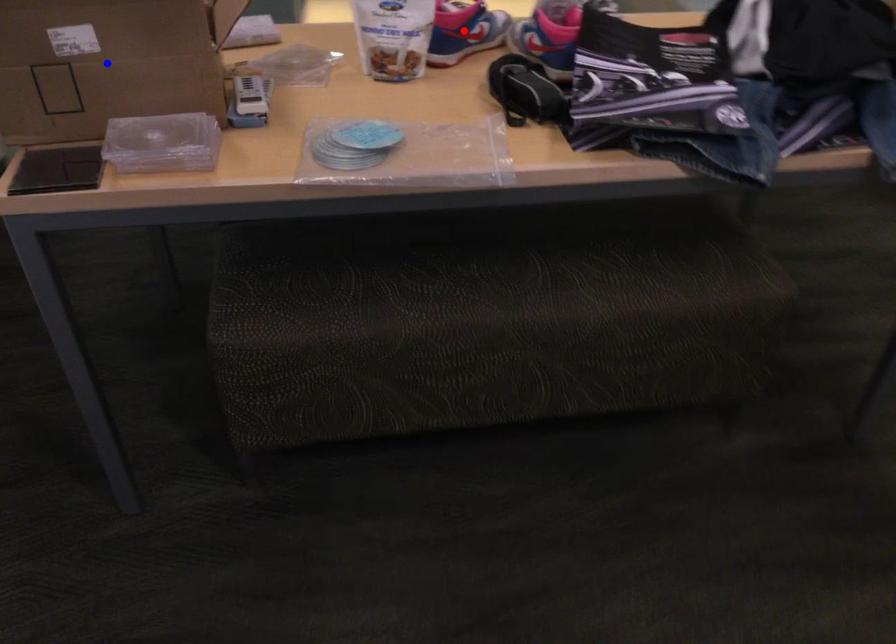
Question: In the image, two points are highlighted. Which point is nearer to the camera? Reply with the corresponding letter.

Choices:
 (A) blue point
 (B) red point

Answer: (A)